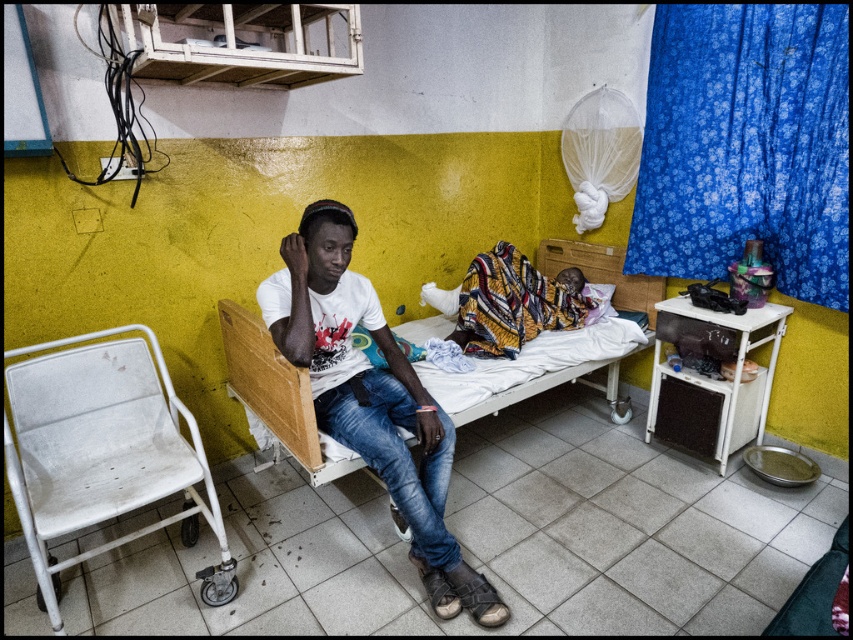
Can you confirm if white metal chair at lower left is positioned below printed fabric baby at center?

Indeed, white metal chair at lower left is positioned under printed fabric baby at center.

Who is more forward, (x=22, y=518) or (x=497, y=301)?

Positioned in front is point (x=22, y=518).

Locate an element on the screen. Image resolution: width=853 pixels, height=640 pixels. white metal chair at lower left is located at coordinates (103, 452).

The width and height of the screenshot is (853, 640). I want to click on white metal chair at lower left, so click(x=103, y=452).

Is point (340, 372) closer to viewer compared to point (480, 317)?

Yes, point (340, 372) is in front of point (480, 317).

Is white matte t-shirt at center closer to camera compared to printed fabric baby at center?

Yes, white matte t-shirt at center is closer to the viewer.

Who is more distant from viewer, (x=335, y=323) or (x=555, y=321)?

The point (x=555, y=321) is more distant.

This screenshot has width=853, height=640. Find the location of `white matte t-shirt at center`. white matte t-shirt at center is located at coordinates (370, 397).

Who is positioned more to the left, white metal chair at lower left or white matte t-shirt at center?

white metal chair at lower left is more to the left.

Between point (196, 451) and point (320, 317), which one is positioned behind?

The point (320, 317) is more distant.

Identify the location of white metal chair at lower left. This screenshot has width=853, height=640. coord(103,452).